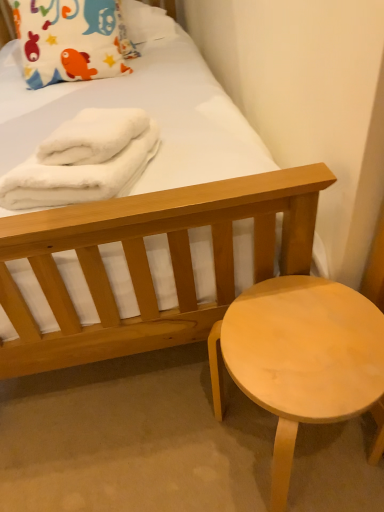
Consider the image. How much space does white fluffy towel at upper left, which ranks as the first bath towel in right-to-left order, occupy vertically?

white fluffy towel at upper left, which ranks as the first bath towel in right-to-left order, is 11.27 centimeters in height.

Describe the element at coordinates (71, 40) in the screenshot. Image resolution: width=384 pixels, height=512 pixels. I see `matte cotton pillow at upper left` at that location.

This screenshot has width=384, height=512. I want to click on light wood stool at lower right, so click(299, 358).

The image size is (384, 512). In order to click on white fluffy towel at upper left, which ranks as the first bath towel in right-to-left order in this screenshot , I will do `click(93, 136)`.

Could you tell me if light wood stool at lower right is turned towards white fluffy bath towel at upper left, marked as the 1th bath towel in a left-to-right arrangement?

No, light wood stool at lower right is not turned towards white fluffy bath towel at upper left, marked as the 1th bath towel in a left-to-right arrangement.

Is white fluffy bath towel at upper left, marked as the 1th bath towel in a left-to-right arrangement, inside light wood stool at lower right?

That's incorrect, white fluffy bath towel at upper left, marked as the 1th bath towel in a left-to-right arrangement, is not inside light wood stool at lower right.

Is light wood stool at lower right next to white fluffy bath towel at upper left, marked as the 1th bath towel in a left-to-right arrangement?

They are not placed beside each other.

From the image's perspective, which one is positioned higher, light wood stool at lower right or white fluffy bath towel at upper left, marked as the 1th bath towel in a left-to-right arrangement?

white fluffy bath towel at upper left, marked as the 1th bath towel in a left-to-right arrangement, from the image's perspective.

Is point (122, 118) positioned after point (63, 27)?

No, (122, 118) is in front of (63, 27).

Considering the positions of objects white fluffy towel at upper left, which ranks as the second bath towel in left-to-right order, and matte cotton pillow at upper left in the image provided, who is behind, white fluffy towel at upper left, which ranks as the second bath towel in left-to-right order, or matte cotton pillow at upper left?

matte cotton pillow at upper left is behind.

From a real-world perspective, which object stands above the other?

From a 3D spatial view, matte cotton pillow at upper left is above.

From the picture: Is white fluffy towel at upper left, which ranks as the second bath towel in left-to-right order, aimed at white fluffy bath towel at upper left, marked as the 1th bath towel in a left-to-right arrangement?

No, white fluffy towel at upper left, which ranks as the second bath towel in left-to-right order, is not aimed at white fluffy bath towel at upper left, marked as the 1th bath towel in a left-to-right arrangement.

Who is more distant, white fluffy towel at upper left, which ranks as the first bath towel in right-to-left order, or white fluffy bath towel at upper left, marked as the 2th bath towel in a right-to-left arrangement?

white fluffy towel at upper left, which ranks as the first bath towel in right-to-left order, is behind.

Considering the relative sizes of white fluffy towel at upper left, which ranks as the first bath towel in right-to-left order, and white fluffy bath towel at upper left, marked as the 1th bath towel in a left-to-right arrangement, in the image provided, is white fluffy towel at upper left, which ranks as the first bath towel in right-to-left order, taller than white fluffy bath towel at upper left, marked as the 1th bath towel in a left-to-right arrangement,?

No, white fluffy towel at upper left, which ranks as the first bath towel in right-to-left order, is not taller than white fluffy bath towel at upper left, marked as the 1th bath towel in a left-to-right arrangement.

Are white fluffy towel at upper left, which ranks as the second bath towel in left-to-right order, and white fluffy bath towel at upper left, marked as the 2th bath towel in a right-to-left arrangement, far apart?

white fluffy towel at upper left, which ranks as the second bath towel in left-to-right order, is actually quite close to white fluffy bath towel at upper left, marked as the 2th bath towel in a right-to-left arrangement.

Looking at this image, based on their positions, is white fluffy bath towel at upper left, marked as the 1th bath towel in a left-to-right arrangement, located to the left or right of light wood stool at lower right?

Based on their positions, white fluffy bath towel at upper left, marked as the 1th bath towel in a left-to-right arrangement, is located to the left of light wood stool at lower right.

Can you confirm if white fluffy bath towel at upper left, marked as the 2th bath towel in a right-to-left arrangement, is thinner than light wood stool at lower right?

No, white fluffy bath towel at upper left, marked as the 2th bath towel in a right-to-left arrangement, is not thinner than light wood stool at lower right.

Consider the image. Considering the sizes of white fluffy bath towel at upper left, marked as the 2th bath towel in a right-to-left arrangement, and light wood stool at lower right in the image, is white fluffy bath towel at upper left, marked as the 2th bath towel in a right-to-left arrangement, bigger or smaller than light wood stool at lower right?

Clearly, white fluffy bath towel at upper left, marked as the 2th bath towel in a right-to-left arrangement, is smaller in size than light wood stool at lower right.

Is white fluffy bath towel at upper left, marked as the 1th bath towel in a left-to-right arrangement, situated inside light wood stool at lower right or outside?

white fluffy bath towel at upper left, marked as the 1th bath towel in a left-to-right arrangement, is not inside light wood stool at lower right, it's outside.

The width and height of the screenshot is (384, 512). I want to click on pillow above the light wood stool at lower right (from the image's perspective), so click(71, 40).

From the image's perspective, which is above, matte cotton pillow at upper left or light wood stool at lower right?

matte cotton pillow at upper left appears higher in the image.

Is matte cotton pillow at upper left placed right next to light wood stool at lower right?

They are not placed beside each other.

Is matte cotton pillow at upper left outside of light wood stool at lower right?

Yes.

Considering the sizes of white fluffy towel at upper left, which ranks as the first bath towel in right-to-left order, and light wood stool at lower right in the image, is white fluffy towel at upper left, which ranks as the first bath towel in right-to-left order, taller or shorter than light wood stool at lower right?

In the image, white fluffy towel at upper left, which ranks as the first bath towel in right-to-left order, appears to be shorter than light wood stool at lower right.

Which is closer to the camera, (87, 158) or (212, 358)?

The point (87, 158) is closer to the camera.

Does white fluffy towel at upper left, which ranks as the first bath towel in right-to-left order, turn towards light wood stool at lower right?

No, white fluffy towel at upper left, which ranks as the first bath towel in right-to-left order, is not aimed at light wood stool at lower right.

Is white fluffy towel at upper left, which ranks as the second bath towel in left-to-right order, at the back of light wood stool at lower right?

No, light wood stool at lower right is not facing the opposite direction of white fluffy towel at upper left, which ranks as the second bath towel in left-to-right order.

Is light wood stool at lower right completely or partially outside of white fluffy towel at upper left, which ranks as the first bath towel in right-to-left order?

That's correct, light wood stool at lower right is outside of white fluffy towel at upper left, which ranks as the first bath towel in right-to-left order.

Identify the location of bath towel that is the 2nd object located behind the light wood stool at lower right. (93, 136).

Can you confirm if light wood stool at lower right is wider than white fluffy towel at upper left, which ranks as the first bath towel in right-to-left order?

Correct, the width of light wood stool at lower right exceeds that of white fluffy towel at upper left, which ranks as the first bath towel in right-to-left order.

You are a GUI agent. You are given a task and a screenshot of the screen. Output one action in this format:
    pyautogui.click(x=<x>, y=<y>)
    Task: Click on the stool located in front of the white fluffy bath towel at upper left, marked as the 1th bath towel in a left-to-right arrangement
    The height and width of the screenshot is (512, 384).
    Given the screenshot: What is the action you would take?
    pyautogui.click(x=299, y=358)

Locate an element on the screen. This screenshot has width=384, height=512. pillow above the white fluffy towel at upper left, which ranks as the second bath towel in left-to-right order (from a real-world perspective) is located at coordinates (71, 40).

From the image, which object appears to be nearer to white fluffy towel at upper left, which ranks as the first bath towel in right-to-left order, white fluffy bath towel at upper left, marked as the 2th bath towel in a right-to-left arrangement, or light wood stool at lower right?

white fluffy bath towel at upper left, marked as the 2th bath towel in a right-to-left arrangement.

Considering their positions, is white fluffy bath towel at upper left, marked as the 2th bath towel in a right-to-left arrangement, positioned closer to light wood stool at lower right than matte cotton pillow at upper left?

Among the two, white fluffy bath towel at upper left, marked as the 2th bath towel in a right-to-left arrangement, is located nearer to light wood stool at lower right.

Based on their spatial positions, is matte cotton pillow at upper left or white fluffy bath towel at upper left, marked as the 2th bath towel in a right-to-left arrangement, closer to white fluffy towel at upper left, which ranks as the second bath towel in left-to-right order?

Based on the image, white fluffy bath towel at upper left, marked as the 2th bath towel in a right-to-left arrangement, appears to be nearer to white fluffy towel at upper left, which ranks as the second bath towel in left-to-right order.

Looking at this image, looking at the image, which one is located closer to light wood stool at lower right, matte cotton pillow at upper left or white fluffy towel at upper left, which ranks as the second bath towel in left-to-right order?

The object closer to light wood stool at lower right is white fluffy towel at upper left, which ranks as the second bath towel in left-to-right order.

Estimate the real-world distances between objects in this image. Which object is further from light wood stool at lower right, white fluffy bath towel at upper left, marked as the 1th bath towel in a left-to-right arrangement, or white fluffy towel at upper left, which ranks as the second bath towel in left-to-right order?

white fluffy towel at upper left, which ranks as the second bath towel in left-to-right order, is positioned further to the anchor light wood stool at lower right.

Considering their positions, is matte cotton pillow at upper left positioned further to white fluffy bath towel at upper left, marked as the 1th bath towel in a left-to-right arrangement, than white fluffy towel at upper left, which ranks as the first bath towel in right-to-left order?

matte cotton pillow at upper left lies further to white fluffy bath towel at upper left, marked as the 1th bath towel in a left-to-right arrangement, than the other object.

Which object lies further to the anchor point white fluffy towel at upper left, which ranks as the second bath towel in left-to-right order, white fluffy bath towel at upper left, marked as the 1th bath towel in a left-to-right arrangement, or matte cotton pillow at upper left?

matte cotton pillow at upper left is further to white fluffy towel at upper left, which ranks as the second bath towel in left-to-right order.

When comparing their distances from matte cotton pillow at upper left, does white fluffy bath towel at upper left, marked as the 2th bath towel in a right-to-left arrangement, or white fluffy towel at upper left, which ranks as the first bath towel in right-to-left order, seem closer?

white fluffy towel at upper left, which ranks as the first bath towel in right-to-left order, is closer to matte cotton pillow at upper left.

Where is `bath towel located between white fluffy bath towel at upper left, marked as the 1th bath towel in a left-to-right arrangement, and matte cotton pillow at upper left in the depth direction`? This screenshot has width=384, height=512. bath towel located between white fluffy bath towel at upper left, marked as the 1th bath towel in a left-to-right arrangement, and matte cotton pillow at upper left in the depth direction is located at coordinates (93, 136).

This screenshot has height=512, width=384. I want to click on bath towel that lies between white fluffy towel at upper left, which ranks as the first bath towel in right-to-left order, and light wood stool at lower right from top to bottom, so click(x=84, y=160).